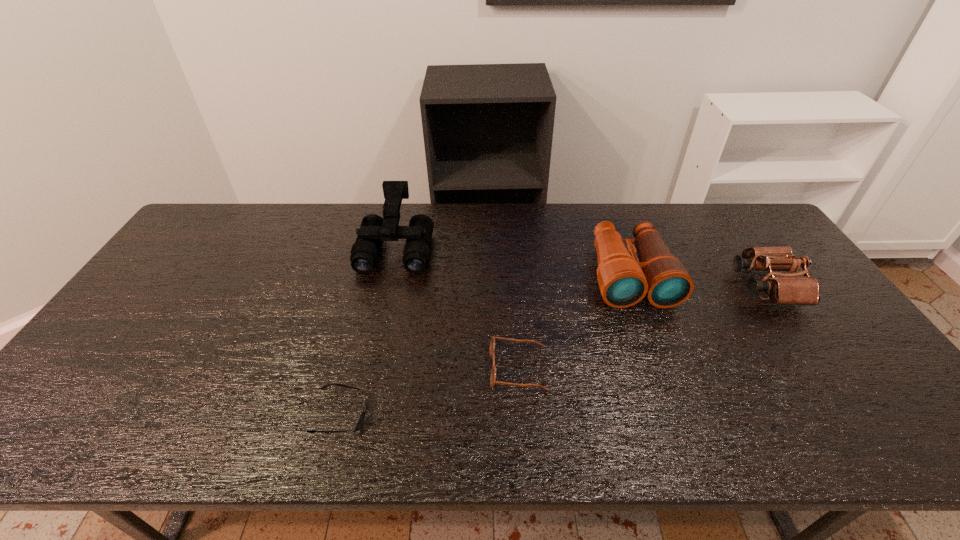
Where is `object located at the right edge`? The image size is (960, 540). object located at the right edge is located at coordinates (788, 290).

Locate an element on the screen. free spot at the far edge of the desktop is located at coordinates (473, 218).

The width and height of the screenshot is (960, 540). Find the location of `free region at the near edge of the desktop`. free region at the near edge of the desktop is located at coordinates (640, 427).

Locate an element on the screen. This screenshot has width=960, height=540. vacant space at the right edge of the desktop is located at coordinates (828, 349).

Where is `vacant region at the near right corner of the desktop`? This screenshot has width=960, height=540. vacant region at the near right corner of the desktop is located at coordinates (864, 417).

I want to click on free space between the fourth object from left to right and the sunglasses, so click(x=486, y=345).

Find the location of a particular element. This screenshot has height=540, width=960. vacant area that lies between the second binoculars from right to left and the tallest object is located at coordinates (513, 261).

The height and width of the screenshot is (540, 960). Identify the location of free space between the fourth object from left to right and the leftmost binoculars. (513, 261).

Identify the location of unoccupied position between the sunglasses and the third shortest object. The image size is (960, 540). (554, 350).

You are a GUI agent. You are given a task and a screenshot of the screen. Output one action in this format:
    pyautogui.click(x=<x>, y=<y>)
    Task: Click on the vacant space that is in between the tallest binoculars and the third object from right to left
    Image resolution: width=960 pixels, height=540 pixels.
    Given the screenshot: What is the action you would take?
    pyautogui.click(x=457, y=308)